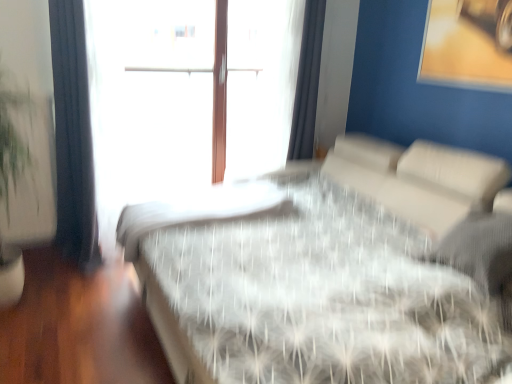
Question: From the image's perspective, is white sheer curtain at upper right, which is counted as the second curtain, starting from the left, under white textured bed at center?

Choices:
 (A) yes
 (B) no

Answer: (B)

Question: From the image's perspective, is white sheer curtain at upper right, the 2th curtain viewed from the front, located above white textured bed at center?

Choices:
 (A) yes
 (B) no

Answer: (A)

Question: Does white sheer curtain at upper right, placed as the first curtain when sorted from back to front, appear on the right side of white textured bed at center?

Choices:
 (A) yes
 (B) no

Answer: (A)

Question: Considering the relative sizes of white sheer curtain at upper right, arranged as the 1th curtain when viewed from the right, and white textured bed at center in the image provided, is white sheer curtain at upper right, arranged as the 1th curtain when viewed from the right, wider than white textured bed at center?

Choices:
 (A) yes
 (B) no

Answer: (B)

Question: Is white sheer curtain at upper right, arranged as the 1th curtain when viewed from the right, taller than white textured bed at center?

Choices:
 (A) yes
 (B) no

Answer: (A)

Question: Considering the positions of white textured mattress at center and white textured bed at center in the image, is white textured mattress at center taller or shorter than white textured bed at center?

Choices:
 (A) tall
 (B) short

Answer: (B)

Question: From the image's perspective, is white textured mattress at center above or below white textured bed at center?

Choices:
 (A) below
 (B) above

Answer: (B)

Question: Relative to white textured bed at center, is white textured mattress at center in front or behind?

Choices:
 (A) front
 (B) behind

Answer: (B)

Question: Based on their sizes in the image, would you say white textured mattress at center is bigger or smaller than white textured bed at center?

Choices:
 (A) small
 (B) big

Answer: (A)

Question: Relative to white sheer curtain at upper right, placed as the first curtain when sorted from back to front, is white textured bed at center in front or behind?

Choices:
 (A) behind
 (B) front

Answer: (B)

Question: From their relative heights in the image, would you say white textured bed at center is taller or shorter than white sheer curtain at upper right, placed as the first curtain when sorted from back to front?

Choices:
 (A) tall
 (B) short

Answer: (B)

Question: From the image's perspective, is white textured bed at center positioned above or below white sheer curtain at upper right, which is counted as the second curtain, starting from the left?

Choices:
 (A) above
 (B) below

Answer: (B)

Question: Is white textured bed at center inside the boundaries of white sheer curtain at upper right, which is counted as the second curtain, starting from the left, or outside?

Choices:
 (A) outside
 (B) inside

Answer: (A)

Question: Considering the positions of point (302, 51) and point (419, 269), is point (302, 51) closer or farther from the camera than point (419, 269)?

Choices:
 (A) closer
 (B) farther

Answer: (B)

Question: Would you say white sheer curtain at upper right, arranged as the 1th curtain when viewed from the right, is inside or outside white textured bed at center?

Choices:
 (A) outside
 (B) inside

Answer: (A)